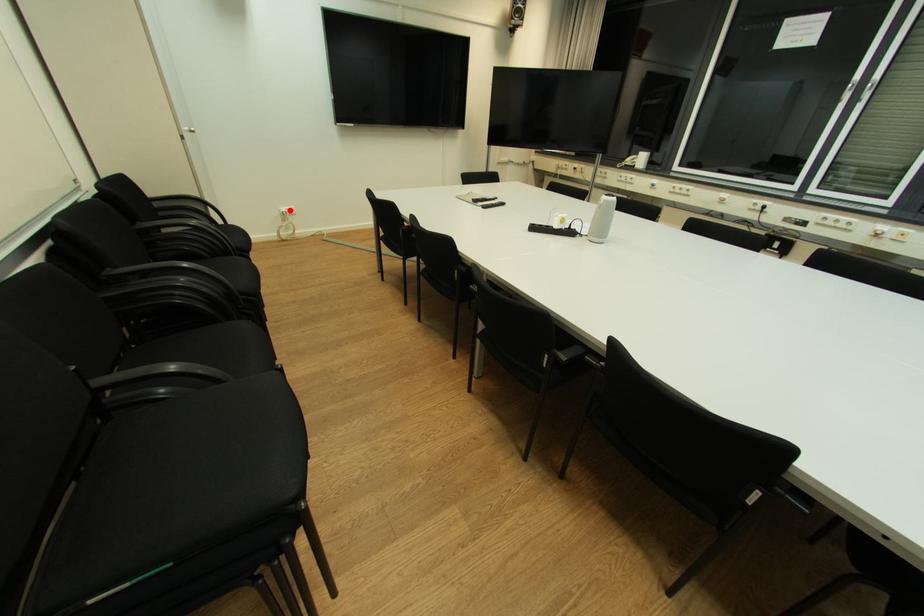
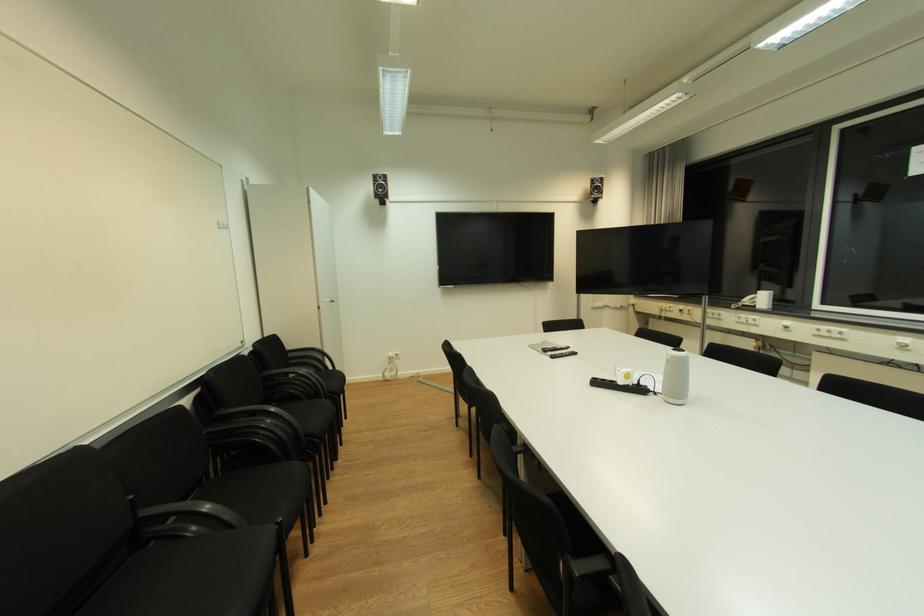
Question: I am providing you with two images of the same scene from different viewpoints. In image1, a red point is highlighted. Considering the same 3D point in image2, which of the following is correct?

Choices:
 (A) It is closer
 (B) It is farther

Answer: (B)